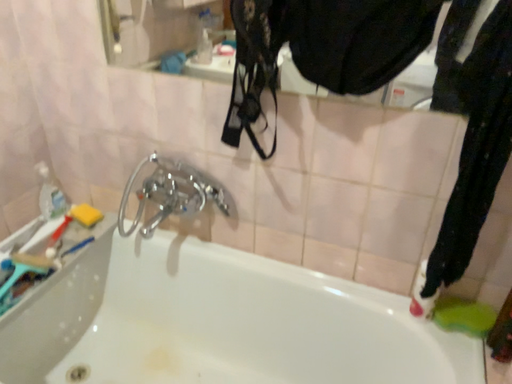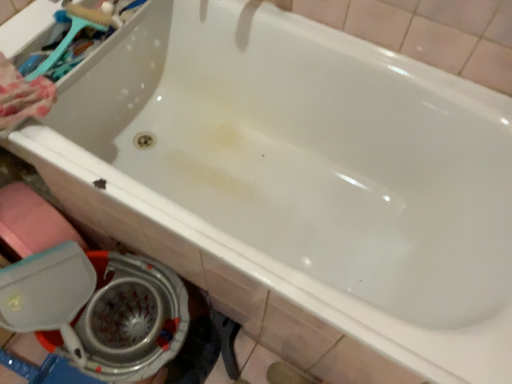
Question: How did the camera likely rotate when shooting the video?

Choices:
 (A) rotated upward
 (B) rotated downward

Answer: (B)